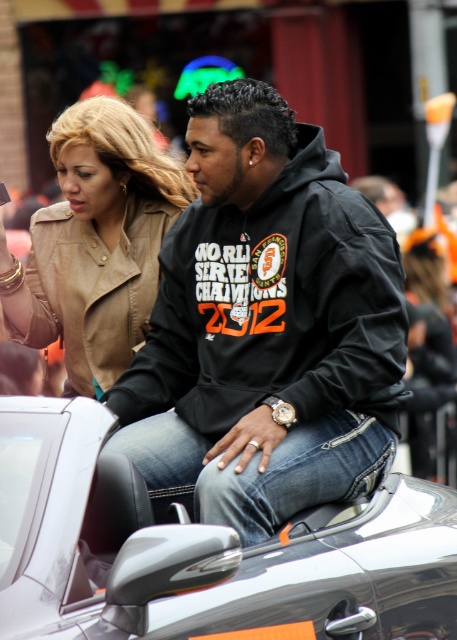
You are a photographer trying to capture a candid shot of the black hoodie at center and the shiny silver convertible at center during the parade. Based on their positions, which object is closer to the camera?

The black hoodie at center is closer to the camera because the shiny silver convertible at center is positioned behind it.

You are planning to park your car next to the shiny silver convertible at center and the leather jacket at center. Which object should you leave more space for when parking?

The shiny silver convertible at center is wider than the leather jacket at center, so you should leave more space for the shiny silver convertible at center when parking.